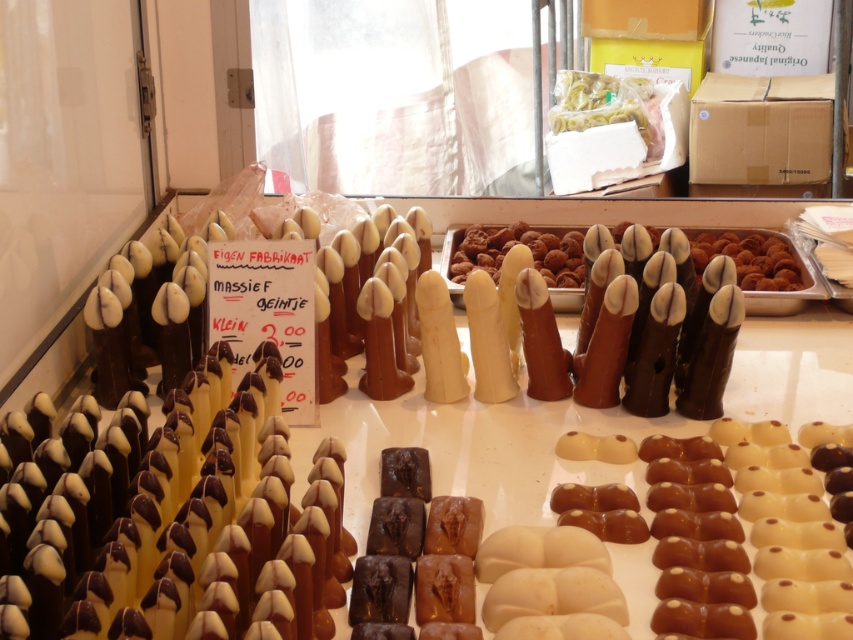
Does brown chocolate finger at center lie behind yellow matte pasta at center?

Result: No, it is not.

Image resolution: width=853 pixels, height=640 pixels. Describe the element at coordinates (527, 248) in the screenshot. I see `brown chocolate finger at center` at that location.

Does point (780, 282) lie in front of point (599, 97)?

Yes.

In order to click on brown chocolate finger at center in this screenshot , I will do `click(527, 248)`.